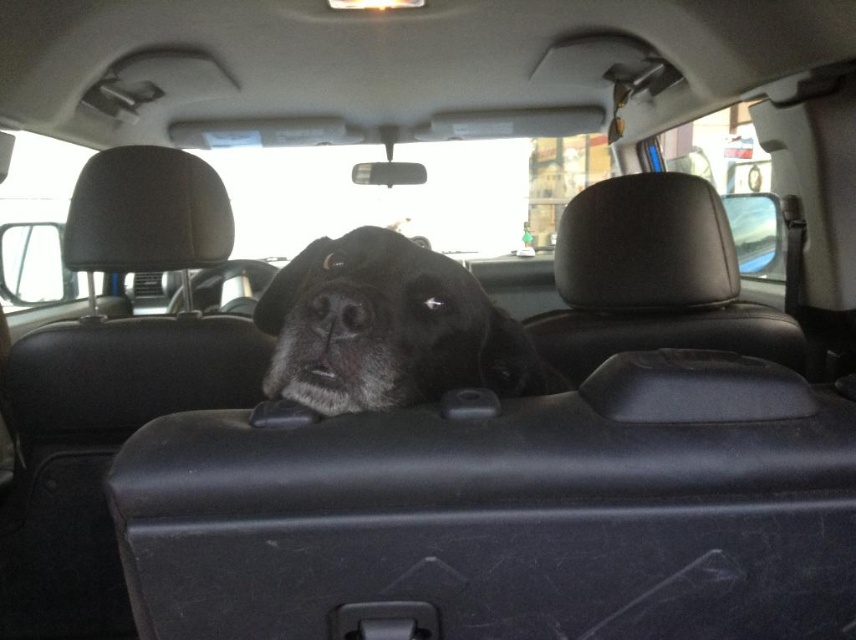
You are sitting in the backseat of the car and want to know which of the two points, point (330, 280) or point (314, 330), is closer to you. Can you determine this based on their positions?

Point (330, 280) is further to the camera than point (314, 330), so the point closer to you in the backseat would be point (314, 330).

You are a passenger in the car and want to take a photo of the black fur dog at center. Where should you aim your camera to capture the dog in the frame?

You should aim your camera at the coordinates point (388,328) to capture the black fur dog at center in the frame.

Based on the photo, you are sitting in the backseat of a car and see the black fur dog at center and the black matte nose at center. Which one is taller?

The black fur dog at center is taller than the black matte nose at center.